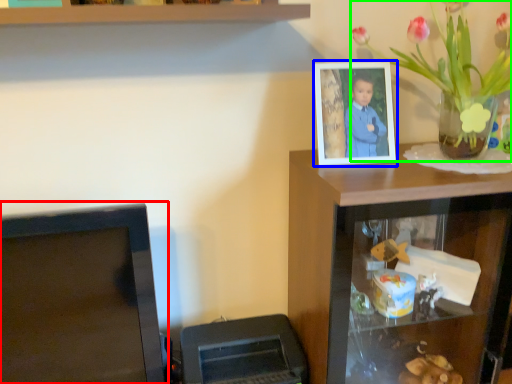
Question: Which is nearer to the computer monitor (highlighted by a red box)? picture frame (highlighted by a blue box) or houseplant (highlighted by a green box).

Choices:
 (A) picture frame
 (B) houseplant

Answer: (A)